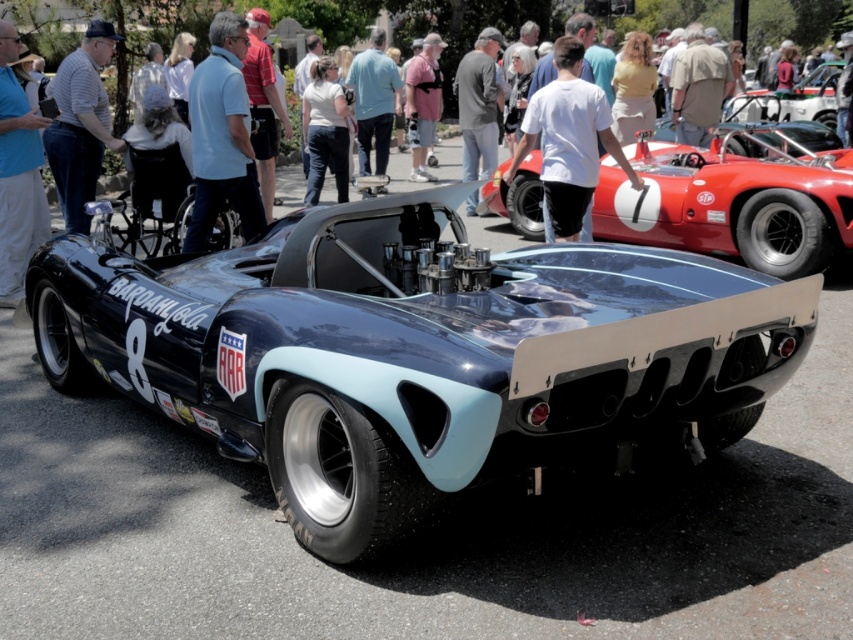
The width and height of the screenshot is (853, 640). What do you see at coordinates (352, 20) in the screenshot?
I see `matte black car at center` at bounding box center [352, 20].

The width and height of the screenshot is (853, 640). In order to click on matte black car at center in this screenshot , I will do `click(352, 20)`.

Locate an element on the screen. The width and height of the screenshot is (853, 640). matte black car at center is located at coordinates (352, 20).

Is light blue shirt at center bigger than striped shirt at left?

Yes.

How far apart are light blue shirt at center and striped shirt at left?

light blue shirt at center is 1.21 meters away from striped shirt at left.

Is point (194, 250) behind point (55, 154)?

No, it is in front of (55, 154).

At what (x,y) coordinates should I click in order to perform the action: click on light blue shirt at center. Please return your answer as a coordinate pair (x, y). The width and height of the screenshot is (853, 640). Looking at the image, I should click on (222, 136).

Who is positioned more to the right, blue fabric shirt at left or light blue jeans at center?

light blue jeans at center is more to the right.

What do you see at coordinates (16, 173) in the screenshot?
I see `blue fabric shirt at left` at bounding box center [16, 173].

Describe the element at coordinates (16, 173) in the screenshot. I see `blue fabric shirt at left` at that location.

Identify the location of blue fabric shirt at left. The height and width of the screenshot is (640, 853). (16, 173).